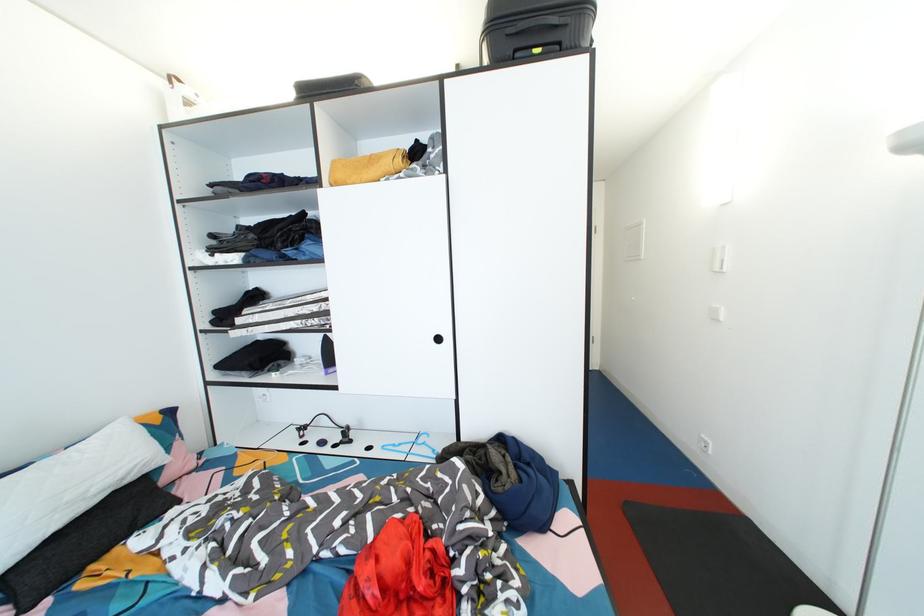
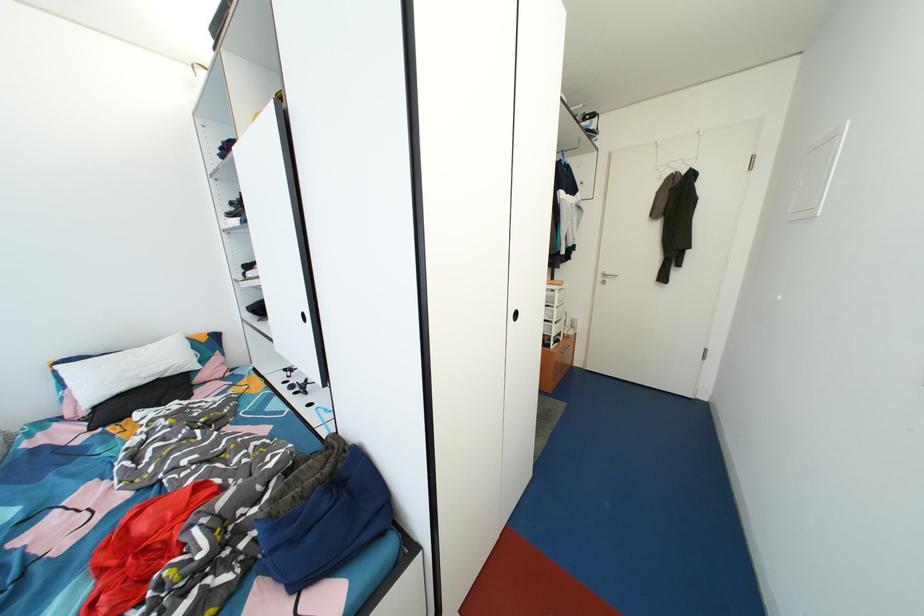
In the second image, find the point that corresponds to point 309,442 in the first image.

(295, 382)